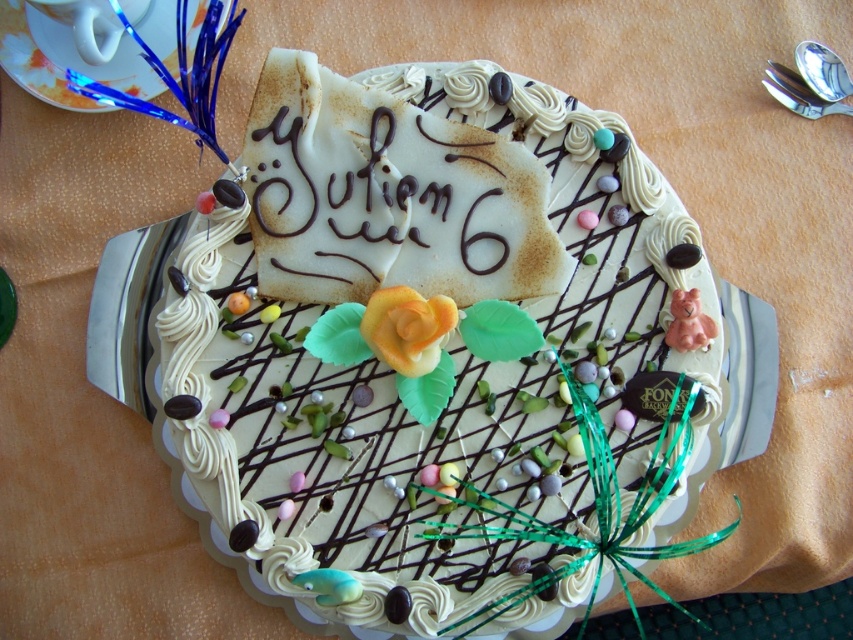
Question: Observing the image, what is the correct spatial positioning of metallic blue platter at upper left in reference to chocolate writing at center?

Choices:
 (A) right
 (B) left

Answer: (B)

Question: Can you confirm if metallic blue platter at upper left is positioned to the left of chocolate writing at center?

Choices:
 (A) no
 (B) yes

Answer: (B)

Question: Estimate the real-world distances between objects in this image. Which object is closer to the chocolate writing at center?

Choices:
 (A) white cream cake at center
 (B) metallic blue platter at upper left

Answer: (A)

Question: Which of the following is the farthest from the observer?

Choices:
 (A) (10, 76)
 (B) (370, 161)
 (C) (303, 451)

Answer: (A)

Question: Among these points, which one is nearest to the camera?

Choices:
 (A) (384, 141)
 (B) (399, 148)
 (C) (38, 84)

Answer: (A)

Question: Does white cream cake at center appear over chocolate writing at center?

Choices:
 (A) yes
 (B) no

Answer: (B)